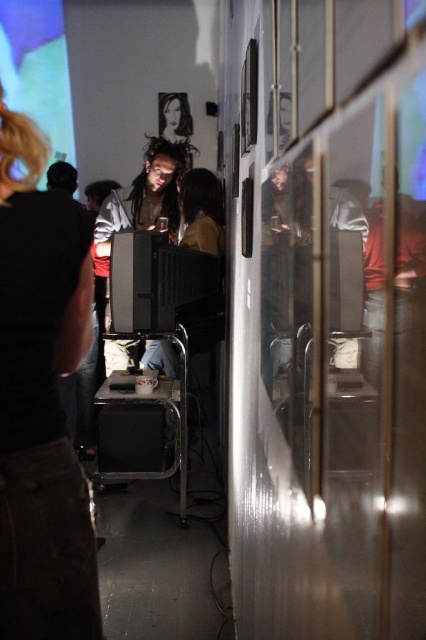
In the scene described, there is a matte black screen at upper left and a black plastic stool at center. From the perspective of someone standing in front of the stool, which object is positioned to the left?

The matte black screen at upper left is to the left of the black plastic stool at center, so from the perspective of someone standing in front of the stool, the matte black screen at upper left would be on their left side.